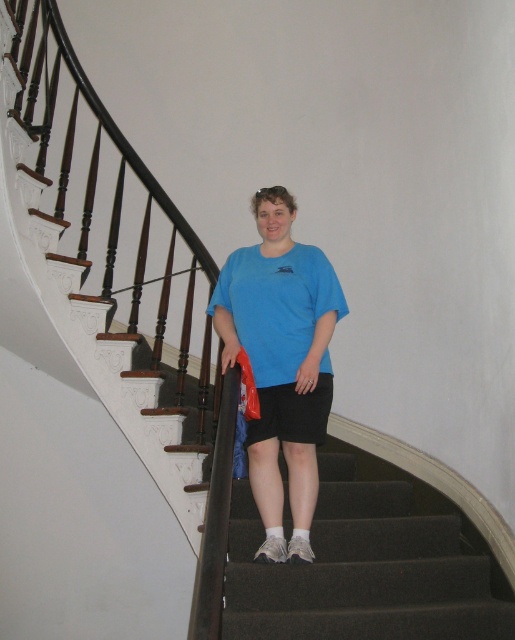
Is dark gray carpet at center shorter than blue matte t-shirt at center?

Correct, dark gray carpet at center is not as tall as blue matte t-shirt at center.

Is dark gray carpet at center smaller than blue matte t-shirt at center?

No.

The width and height of the screenshot is (515, 640). I want to click on dark gray carpet at center, so click(x=367, y=563).

The height and width of the screenshot is (640, 515). What are the coordinates of `dark gray carpet at center` in the screenshot? It's located at (367, 563).

Can you confirm if dark gray carpet at center is thinner than black cotton shorts at center?

Incorrect, dark gray carpet at center's width is not less than black cotton shorts at center's.

Is dark gray carpet at center behind black cotton shorts at center?

No, it is in front of black cotton shorts at center.

Is point (273, 582) less distant than point (252, 442)?

Yes, point (273, 582) is in front of point (252, 442).

I want to click on dark gray carpet at center, so click(x=367, y=563).

Between blue matte t-shirt at center and black cotton shorts at center, which one is positioned higher?

Positioned higher is blue matte t-shirt at center.

Is blue matte t-shirt at center positioned before black cotton shorts at center?

Yes, blue matte t-shirt at center is in front of black cotton shorts at center.

Which is in front, point (265, 273) or point (279, 422)?

Point (279, 422) is more forward.

What are the coordinates of `blue matte t-shirt at center` in the screenshot? It's located at (282, 362).